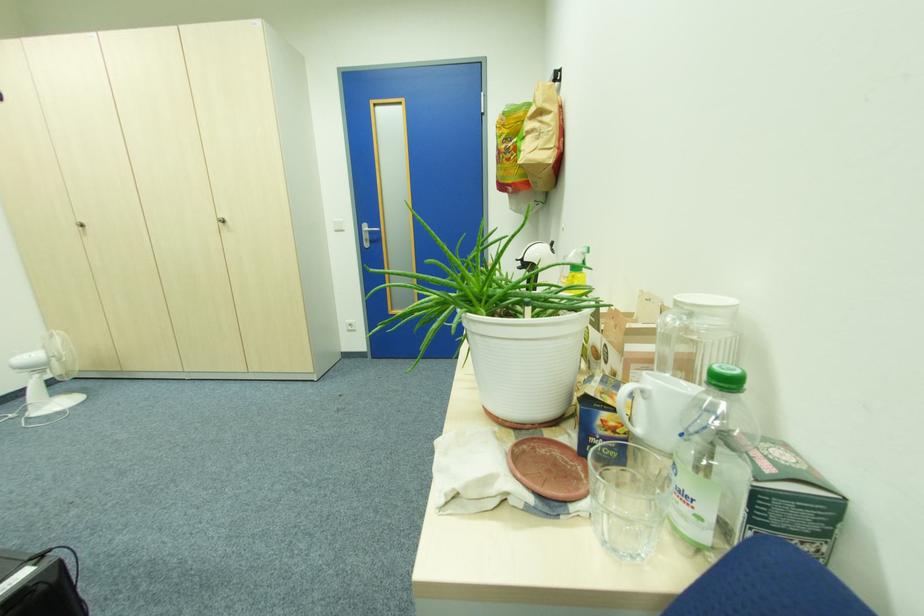
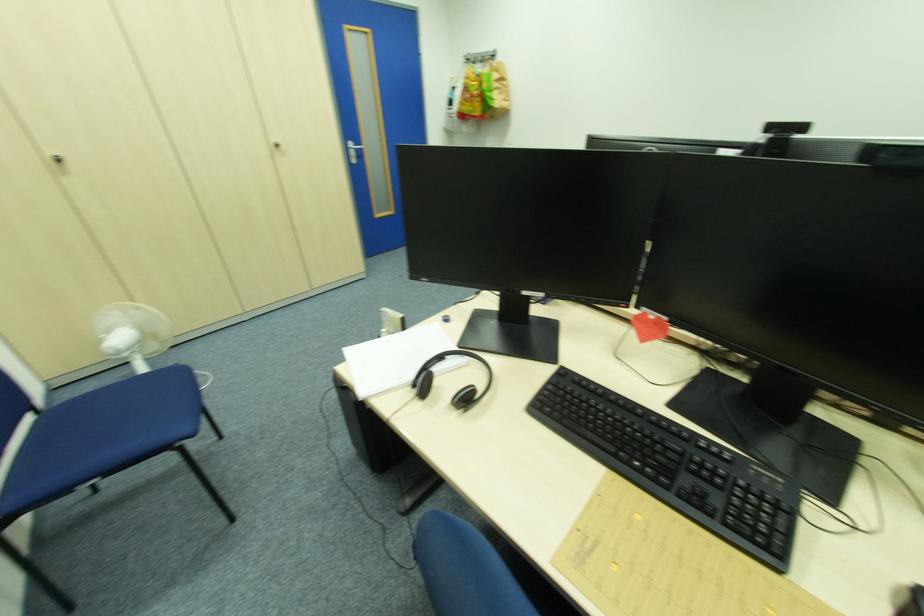
Question: I am providing you with two images of the same scene from different viewpoints. Please identify which objects are invisible in image2.

Choices:
 (A) white binder finger hole
 (B) blue chair sitting surface
 (C) white jar lid
 (D) cabinet door handle

Answer: (C)